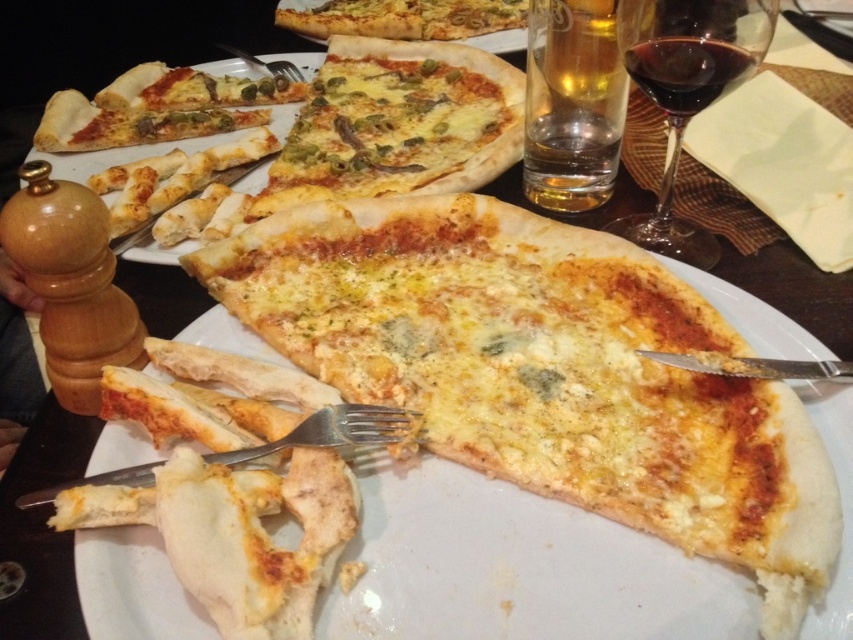
You are at a dinner table and want to reach for the transparent glass wine at upper right and the cheesy pizza at upper center. Which item is positioned lower on the table?

The transparent glass wine at upper right is located below the cheesy pizza at upper center, so it is positioned lower on the table.

You are a guest at a dinner party and see the transparent glass wine at upper right and the dark red liquid at upper right on the table. Which one is positioned higher relative to the other?

The dark red liquid at upper right is positioned higher than the transparent glass wine at upper right because the transparent glass wine at upper right is below it.